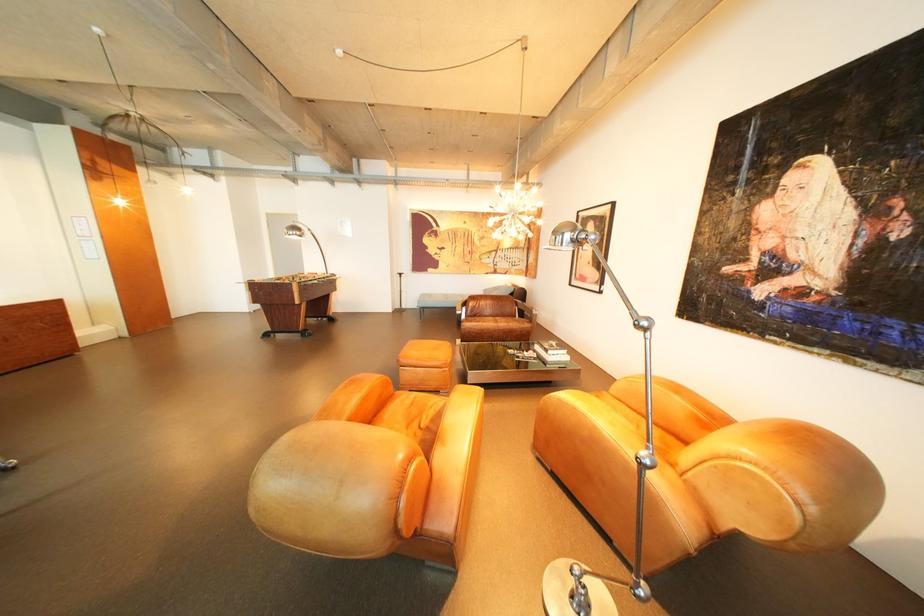
The width and height of the screenshot is (924, 616). Find the location of `orange leather ottoman`. orange leather ottoman is located at coordinates (426, 353).